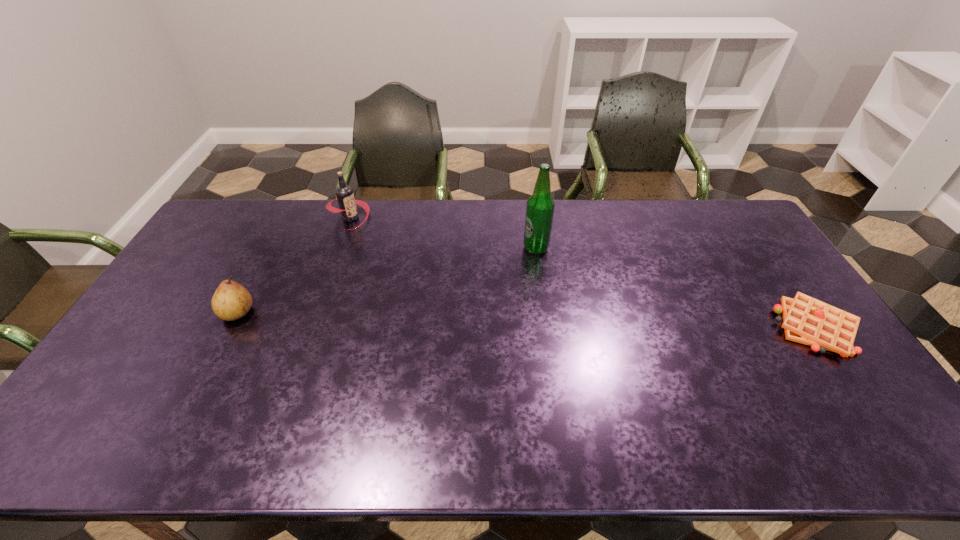
Find the location of a particular element. free space located 0.310m on the label of the second object from left to right is located at coordinates (406, 275).

The width and height of the screenshot is (960, 540). In order to click on free location located on the label of the second object from left to right in this screenshot , I will do `click(413, 282)`.

At what (x,y) coordinates should I click in order to perform the action: click on vacant space located on the label of the second object from left to right. Please return your answer as a coordinate pair (x, y). Image resolution: width=960 pixels, height=540 pixels. Looking at the image, I should click on (402, 272).

Identify the location of vacant space situated 0.270m on the label of the third object from left to right. (495, 307).

Identify the location of vacant space located 0.330m on the label of the third object from left to right. The image size is (960, 540). (486, 321).

I want to click on vacant space located 0.390m on the label of the third object from left to right, so click(x=476, y=335).

Where is `object that is positioned at the far edge`? object that is positioned at the far edge is located at coordinates (x=344, y=193).

This screenshot has width=960, height=540. Identify the location of object located in the right edge section of the desktop. (806, 320).

I want to click on vacant space at the far edge of the desktop, so point(568,237).

Where is `vacant space at the near edge of the desktop`? The height and width of the screenshot is (540, 960). vacant space at the near edge of the desktop is located at coordinates (163, 384).